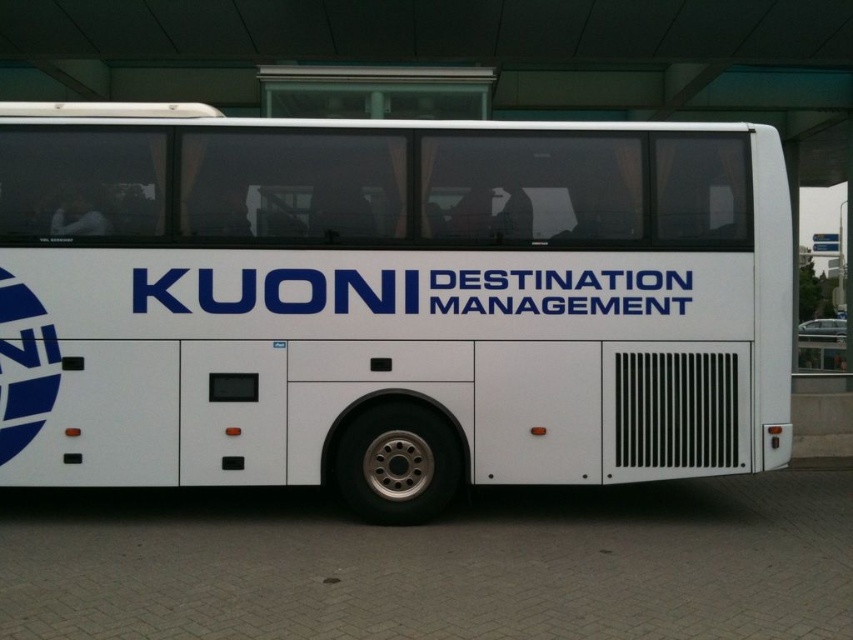
Does white matte bus at center have a greater width compared to bluematerial/texturetext at center?

In fact, white matte bus at center might be narrower than bluematerial/texturetext at center.

Looking at this image, does white matte bus at center appear on the right side of bluematerial/texturetext at center?

No, white matte bus at center is not to the right of bluematerial/texturetext at center.

Find the location of `white matte bus at center`. white matte bus at center is located at coordinates (387, 301).